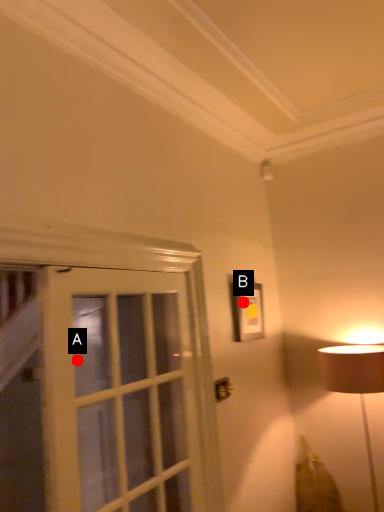
Question: Two points are circled on the image, labeled by A and B beside each circle. Which point is farther to the camera?

Choices:
 (A) A is further
 (B) B is further

Answer: (A)